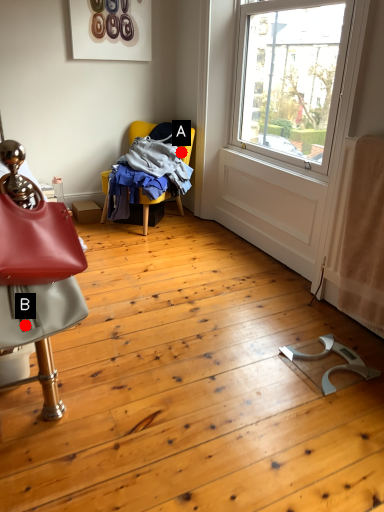
Question: Two points are circled on the image, labeled by A and B beside each circle. Which of the following is the farthest from the observer?

Choices:
 (A) A is further
 (B) B is further

Answer: (A)